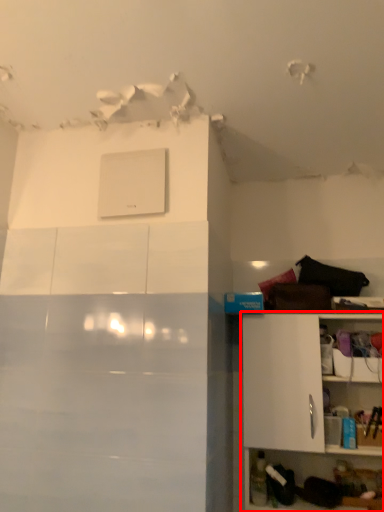
Question: From the image's perspective, what is the correct spatial positioning of shelf (annotated by the red box) in reference to appliance?

Choices:
 (A) below
 (B) above

Answer: (A)